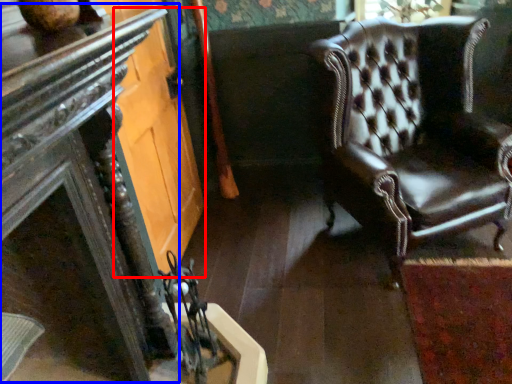
Question: Which point is further to the camera, glass door (highlighted by a red box) or table (highlighted by a blue box)?

Choices:
 (A) glass door
 (B) table

Answer: (A)